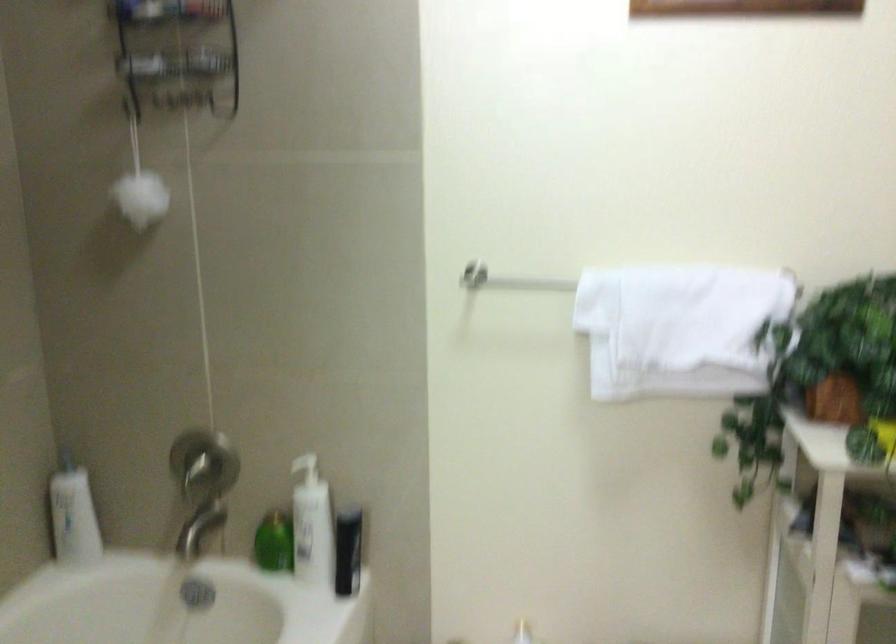
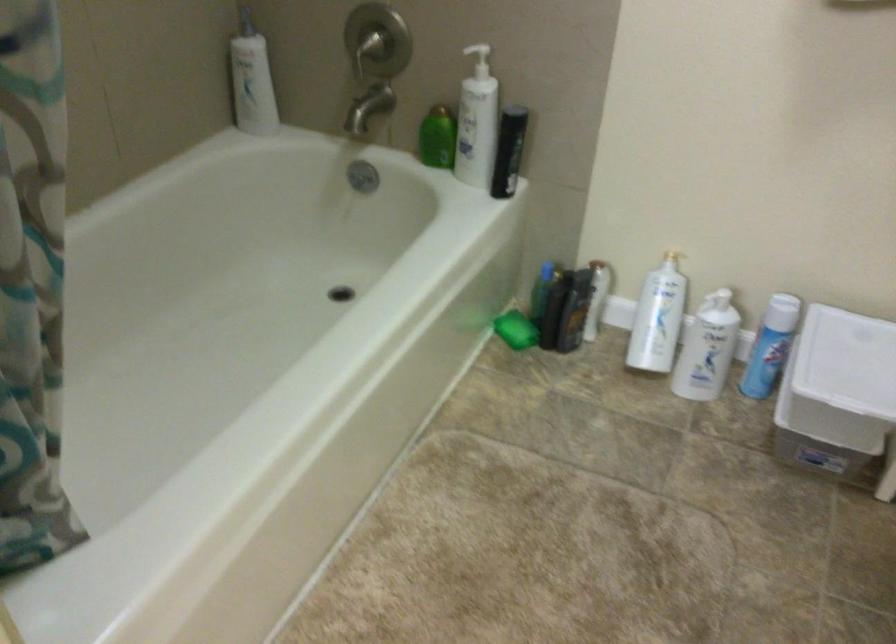
Find the pixel in the second image that matches point (350, 556) in the first image.

(509, 152)